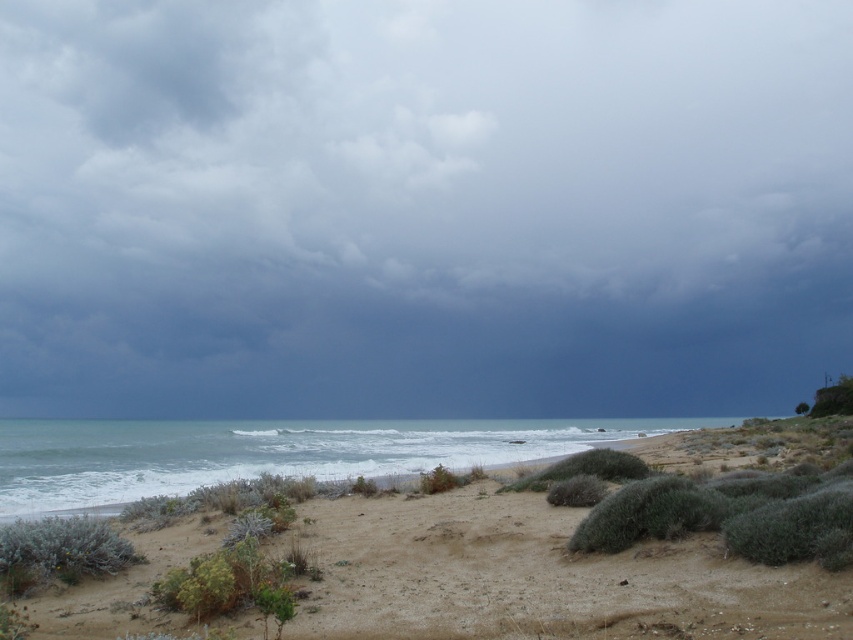
Is dark gray cloud at upper center above green shrub at lower left?

Indeed, dark gray cloud at upper center is positioned over green shrub at lower left.

Is point (363, 328) closer to viewer compared to point (114, 538)?

No, it is not.

You are a GUI agent. You are given a task and a screenshot of the screen. Output one action in this format:
    pyautogui.click(x=<x>, y=<y>)
    Task: Click on the dark gray cloud at upper center
    The width and height of the screenshot is (853, 640).
    Given the screenshot: What is the action you would take?
    pyautogui.click(x=422, y=208)

This screenshot has width=853, height=640. What are the coordinates of `dark gray cloud at upper center` in the screenshot? It's located at (422, 208).

Is point (254, 168) in front of point (614, 604)?

That is False.

Can you confirm if dark gray cloud at upper center is bigger than brown sandy beach at lower center?

Yes.

Between point (723, 13) and point (757, 609), which one is positioned behind?

The point (723, 13) is behind.

Locate an element on the screen. Image resolution: width=853 pixels, height=640 pixels. dark gray cloud at upper center is located at coordinates pyautogui.click(x=422, y=208).

Does dark gray cloud at upper center appear under blue water at lower left?

Incorrect, dark gray cloud at upper center is not positioned below blue water at lower left.

Identify the location of dark gray cloud at upper center. (422, 208).